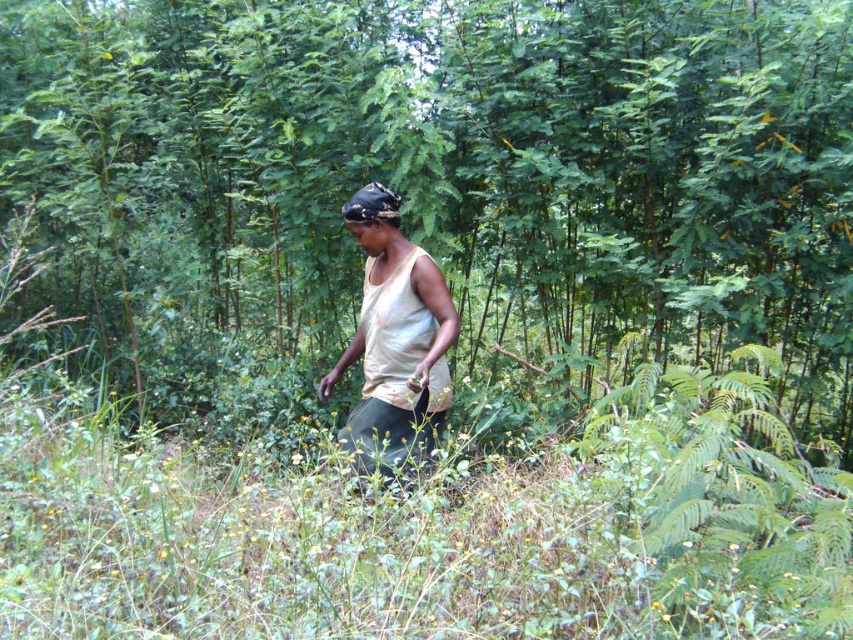
You are a hiker trying to navigate through the dense forest. You notice a green leafy tree at center and a white cotton tank top at center. Which object would block your path more if you try to walk straight ahead?

The green leafy tree at center is larger in size than the white cotton tank top at center, so the tree would block your path more than the tank top.

You are a hiker who wants to take a photo of the green leafy tree at center from exactly 4 meters away. Can you position yourself at that distance?

The green leafy tree at center and camera are 4.08 meters apart, so yes, you can position yourself at exactly 4 meters away from the green leafy tree at center since the distance is slightly more than 4 meters.

You are a hiker trying to take a photo of the green leafy tree at center and the white cotton tank top at center. Which object should you focus on first if you want to capture both in one frame without moving the camera?

The green leafy tree at center is to the right of the white cotton tank top at center. Since the tree is positioned to the right of the tank top, you should focus on the white cotton tank top at center first to ensure both are in the frame without moving the camera.